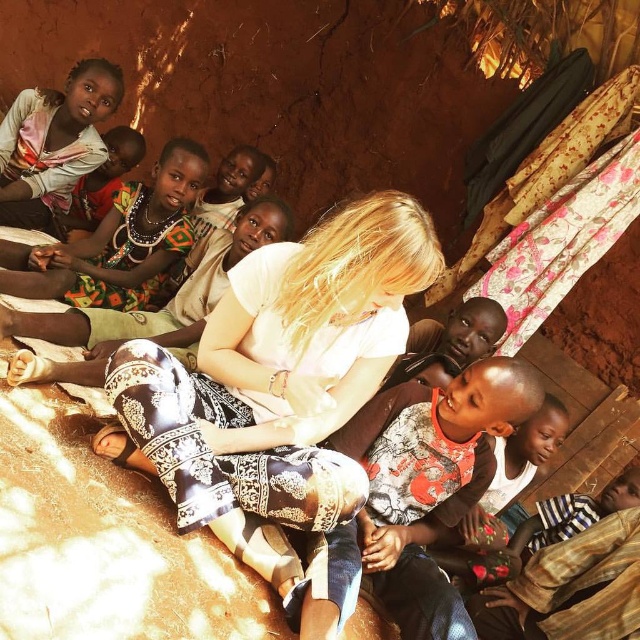
Between white printed pants at center and matte pink scarf at upper left, which one appears on the left side from the viewer's perspective?

matte pink scarf at upper left

Is point (173, 474) positioned behind point (49, 138)?

No, it is not.

Where is `white printed pants at center`? The width and height of the screenshot is (640, 640). white printed pants at center is located at coordinates (276, 381).

Between point (337, 490) and point (172, 204), which one is positioned in front?

Point (337, 490)

Who is positioned more to the left, white printed pants at center or printed fabric dress at upper left?

printed fabric dress at upper left is more to the left.

The width and height of the screenshot is (640, 640). Find the location of `white printed pants at center`. white printed pants at center is located at coordinates (276, 381).

Can you confirm if printed fabric pants at center is thinner than matte pink scarf at upper left?

No, printed fabric pants at center is not thinner than matte pink scarf at upper left.

Who is positioned more to the left, printed fabric pants at center or matte pink scarf at upper left?

Positioned to the left is matte pink scarf at upper left.

Is point (220, 268) more distant than point (20, 161)?

No, (220, 268) is in front of (20, 161).

Image resolution: width=640 pixels, height=640 pixels. What are the coordinates of `printed fabric pants at center` in the screenshot? It's located at (147, 310).